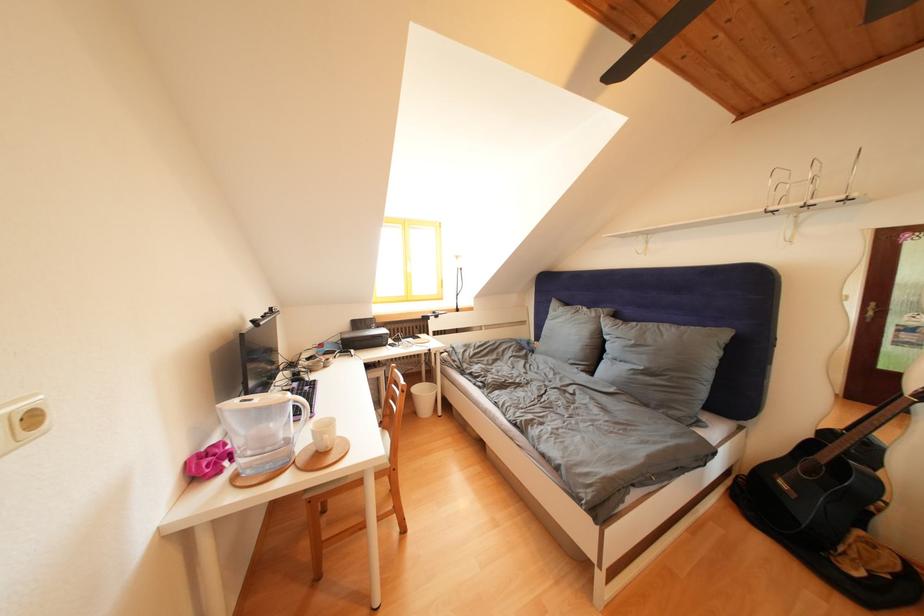
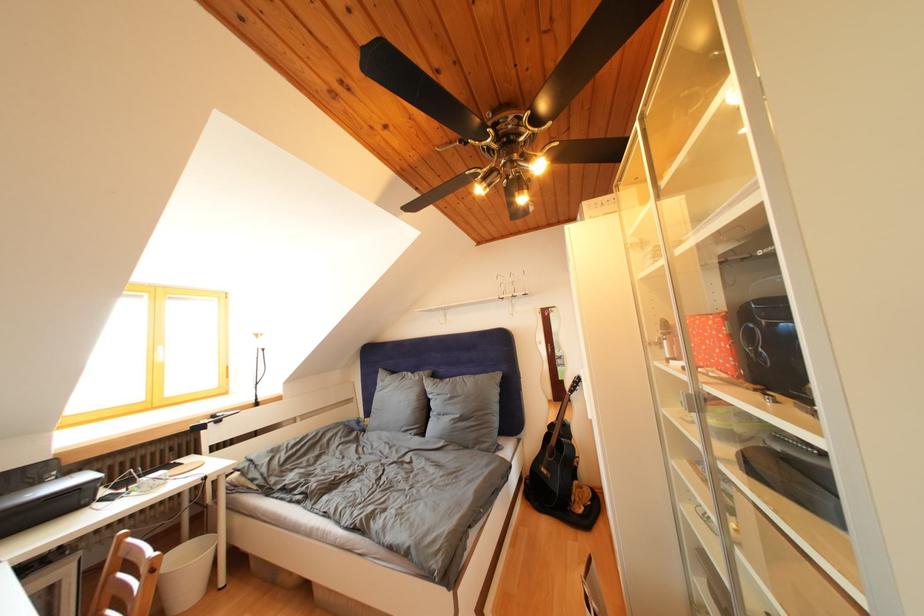
Question: Based on the continuous images, in which direction is the camera rotating? Reply with the corresponding letter.

Choices:
 (A) Left
 (B) Right
 (C) Up
 (D) Down

Answer: (B)